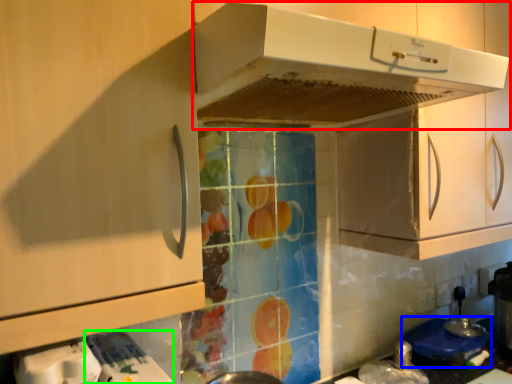
Question: Which object is the farthest from home appliance (highlighted by a red box)? Choose among these: appliance (highlighted by a blue box) or appliance (highlighted by a green box).

Choices:
 (A) appliance
 (B) appliance

Answer: (A)